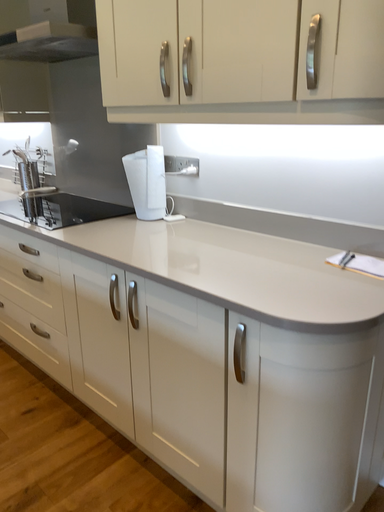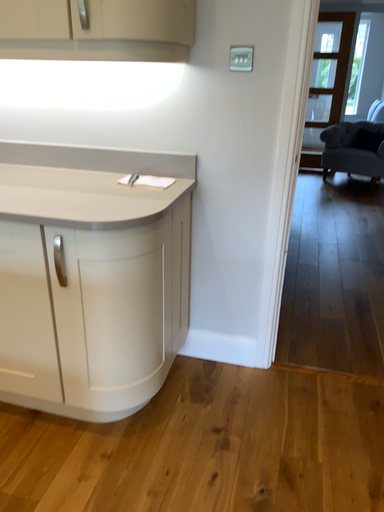
Question: How did the camera likely rotate when shooting the video?

Choices:
 (A) rotated right
 (B) rotated left

Answer: (A)